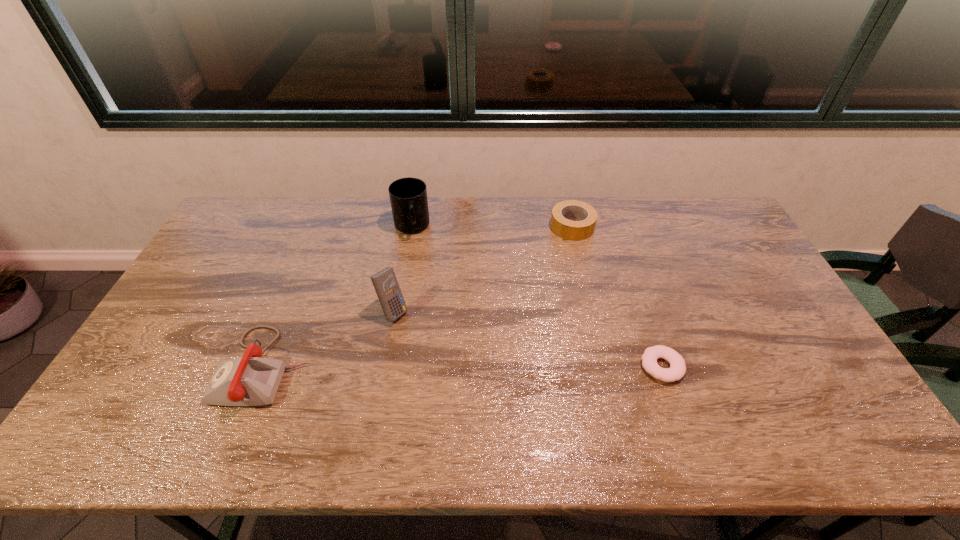
The width and height of the screenshot is (960, 540). Identify the location of free location located on the front-facing side of the calculator. (500, 393).

Where is `duct tape at the far edge`? This screenshot has width=960, height=540. duct tape at the far edge is located at coordinates (587, 215).

I want to click on mug positioned at the far edge, so click(408, 196).

At what (x,y) coordinates should I click in order to perform the action: click on telephone at the near edge. Please return your answer as a coordinate pair (x, y). The image size is (960, 540). Looking at the image, I should click on (250, 380).

I want to click on doughnut positioned at the near edge, so click(x=677, y=369).

I want to click on free region at the far edge, so click(482, 213).

Where is `free space at the near edge`? This screenshot has height=540, width=960. free space at the near edge is located at coordinates (452, 392).

In the image, there is a desktop. Where is `vacant space at the left edge`? vacant space at the left edge is located at coordinates (240, 272).

Where is `free space at the right edge of the desktop`? free space at the right edge of the desktop is located at coordinates (740, 261).

At what (x,y) coordinates should I click in order to perform the action: click on vacant space that is in between the leftmost object and the rightmost object. Please return your answer as a coordinate pair (x, y). Looking at the image, I should click on (464, 367).